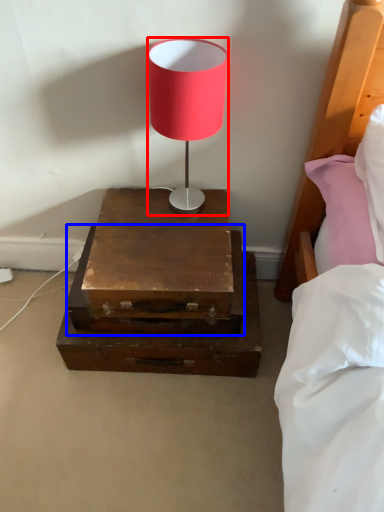
Question: Which point is closer to the camera, lamp (highlighted by a red box) or drawer (highlighted by a blue box)?

Choices:
 (A) lamp
 (B) drawer

Answer: (A)